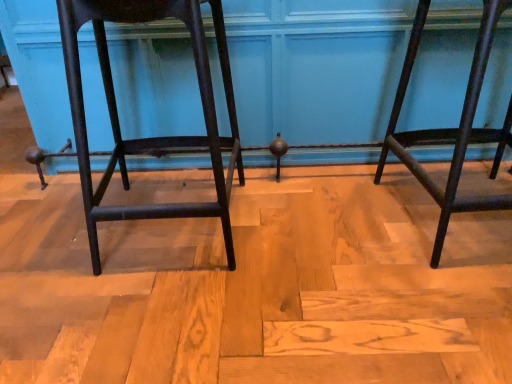
Locate an element on the screen. The height and width of the screenshot is (384, 512). vacant space that is in between matte black stool at left, which is the first furniture from left to right, and matte black stool at right, the 1th furniture from the right is located at coordinates (317, 224).